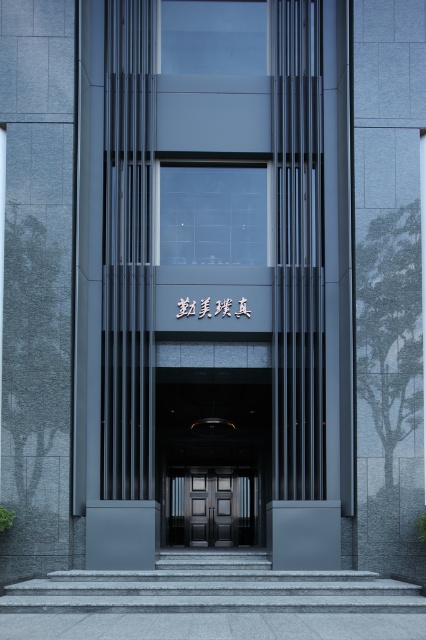
You are a delivery person trying to locate the entrance of the modern building. The building has a matte glass entrance at center. Based on the provided coordinates, can you determine if the entrance is positioned higher or lower than the midpoint of the building facade?

The matte glass entrance at center is located at point coordinates with a y value of 0.502, which is slightly above the midpoint of the building facade. Therefore, the entrance is positioned higher than the midpoint.

You are standing at the entrance of the modern building and want to locate the matte glass entrance at center. According to the coordinates provided, where exactly should you look to find it?

The matte glass entrance at center is located at point coordinates of (213, 259).